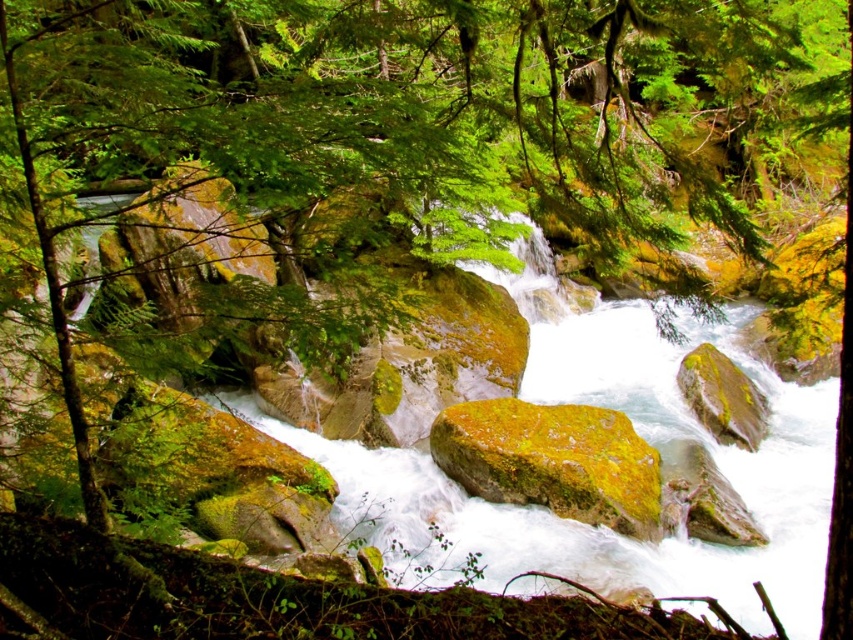
Is green mossy rock at center further to camera compared to green mossy rock at center-right?

No, green mossy rock at center is closer to the viewer.

Who is more distant from viewer, (553, 484) or (697, 392)?

Point (697, 392)

This screenshot has width=853, height=640. In order to click on green mossy rock at center in this screenshot , I will do `click(552, 460)`.